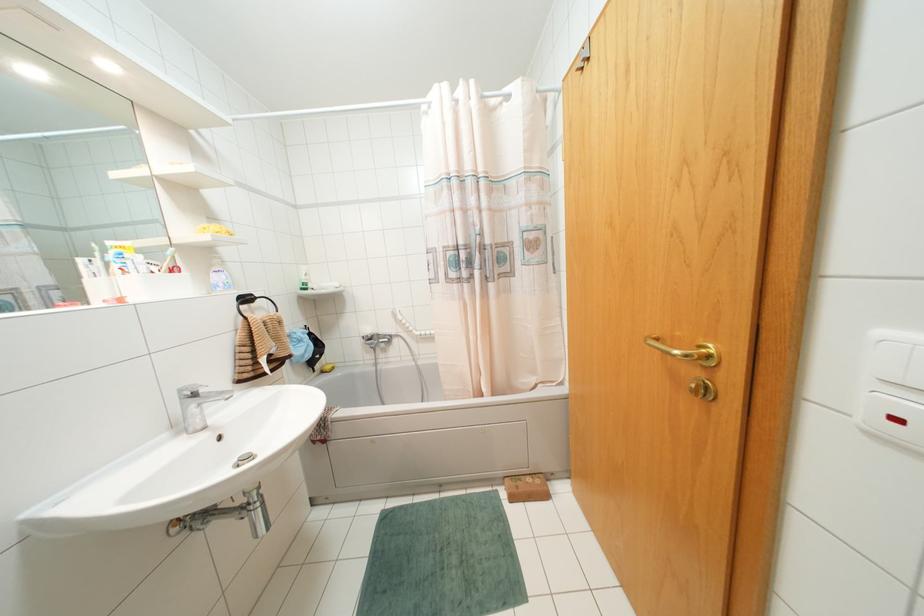
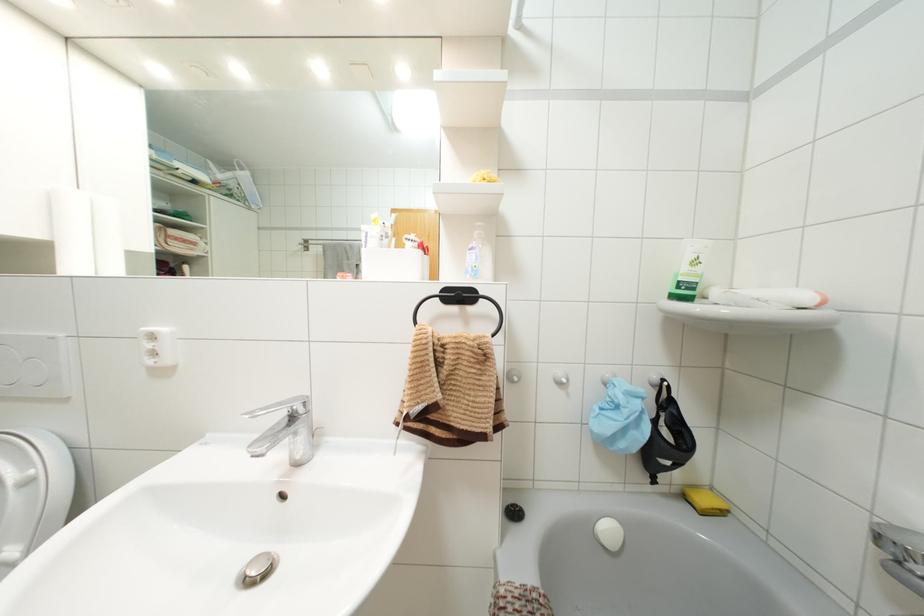
The point at [305,274] is marked in the first image. Where is the corresponding point in the second image?

(695, 262)